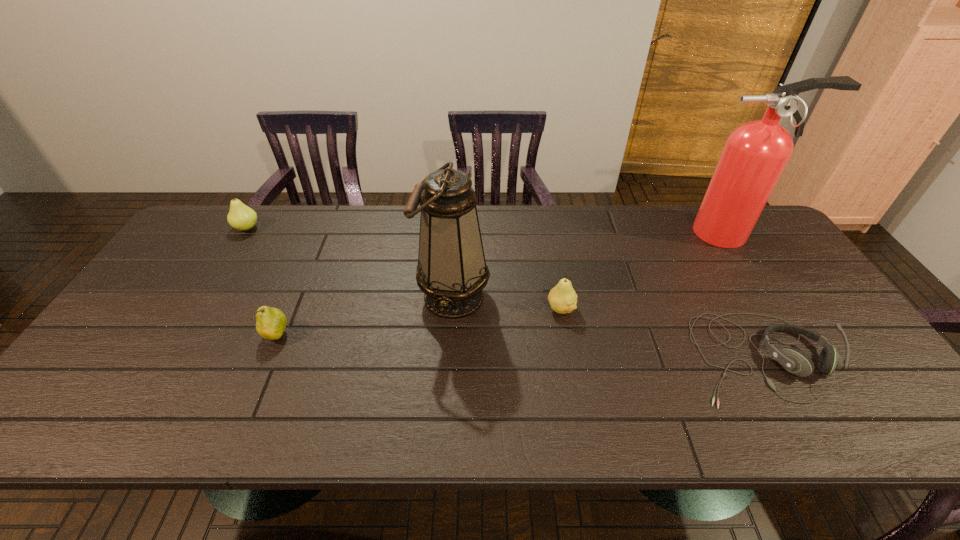
Find the location of a particular element. The width and height of the screenshot is (960, 540). free spot located 0.350m on the front of the fire extinguisher is located at coordinates (800, 341).

Locate an element on the screen. This screenshot has width=960, height=540. free region located 0.190m on the right of the fourth object from right to left is located at coordinates (559, 296).

Where is `blank area located on the front of the farthest pear`? blank area located on the front of the farthest pear is located at coordinates (208, 290).

I want to click on vacant point located 0.390m on the right of the fourth object from left to right, so click(720, 308).

At what (x,y) coordinates should I click in order to perform the action: click on free space located 0.350m on the left of the fifth object from right to left. Please return your answer as a coordinate pair (x, y). Looking at the image, I should click on pyautogui.click(x=126, y=335).

Where is `free space located 0.050m on the outer surface of the headset`? free space located 0.050m on the outer surface of the headset is located at coordinates (802, 431).

The width and height of the screenshot is (960, 540). I want to click on fire extinguisher located at the far edge, so click(755, 154).

Locate an element on the screen. This screenshot has height=540, width=960. pear that is positioned at the far edge is located at coordinates (241, 217).

Locate an element on the screen. object present at the near edge is located at coordinates (794, 361).

The height and width of the screenshot is (540, 960). Identify the location of object that is positioned at the left edge. (241, 217).